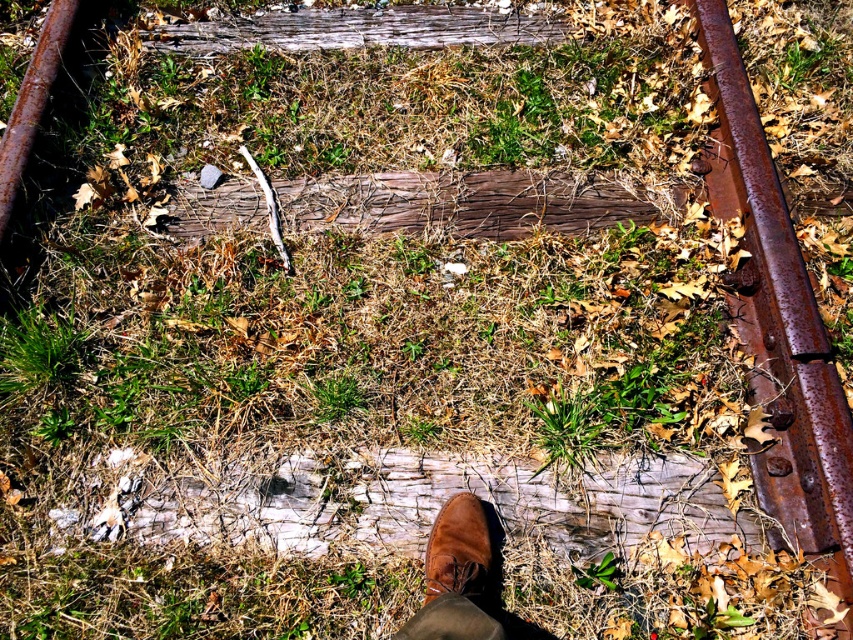
Between rusty metal train track at right and brown suede shoe at center, which one appears on the left side from the viewer's perspective?

brown suede shoe at center

Can you confirm if rusty metal train track at right is positioned below brown suede shoe at center?

Incorrect, rusty metal train track at right is not positioned below brown suede shoe at center.

Does point (813, 522) come behind point (480, 524)?

That is True.

Locate an element on the screen. rusty metal train track at right is located at coordinates (778, 320).